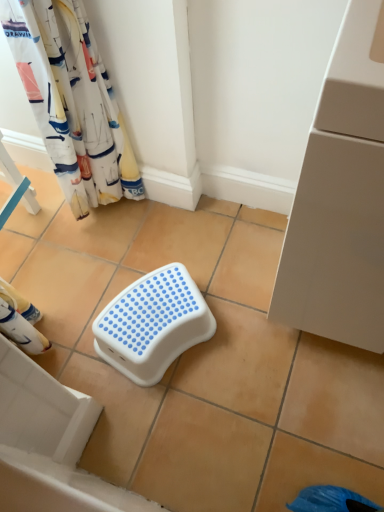
Question: Is white plastic step stool at center looking in the opposite direction of white fabric curtain at upper left?

Choices:
 (A) no
 (B) yes

Answer: (A)

Question: Is white plastic step stool at center bigger than white fabric curtain at upper left?

Choices:
 (A) no
 (B) yes

Answer: (A)

Question: Does white plastic step stool at center come in front of white fabric curtain at upper left?

Choices:
 (A) no
 (B) yes

Answer: (A)

Question: From the image's perspective, is white plastic step stool at center on white fabric curtain at upper left?

Choices:
 (A) yes
 (B) no

Answer: (B)

Question: Can you confirm if white plastic step stool at center is smaller than white fabric curtain at upper left?

Choices:
 (A) yes
 (B) no

Answer: (A)

Question: Is white plastic step stool at center not within white fabric curtain at upper left?

Choices:
 (A) yes
 (B) no

Answer: (A)

Question: Is white plastic step stool at center completely or partially inside white fabric curtain at upper left?

Choices:
 (A) no
 (B) yes

Answer: (A)

Question: From the image's perspective, is white fabric curtain at upper left below white plastic step stool at center?

Choices:
 (A) no
 (B) yes

Answer: (A)

Question: Is white fabric curtain at upper left not close to white plastic step stool at center?

Choices:
 (A) no
 (B) yes

Answer: (A)

Question: From a real-world perspective, is white fabric curtain at upper left located beneath white plastic step stool at center?

Choices:
 (A) yes
 (B) no

Answer: (B)

Question: Is white fabric curtain at upper left to the right of white plastic step stool at center from the viewer's perspective?

Choices:
 (A) yes
 (B) no

Answer: (B)

Question: Does white fabric curtain at upper left appear on the left side of white plastic step stool at center?

Choices:
 (A) yes
 (B) no

Answer: (A)

Question: From their relative heights in the image, would you say white plastic step stool at center is taller or shorter than white fabric curtain at upper left?

Choices:
 (A) short
 (B) tall

Answer: (A)